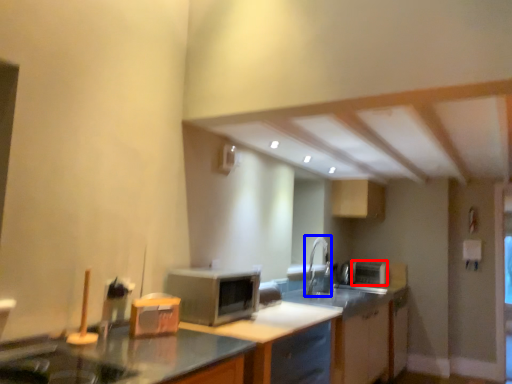
Question: Among these objects, which one is farthest to the camera, appliance (highlighted by a red box) or faucet (highlighted by a blue box)?

Choices:
 (A) appliance
 (B) faucet

Answer: (A)